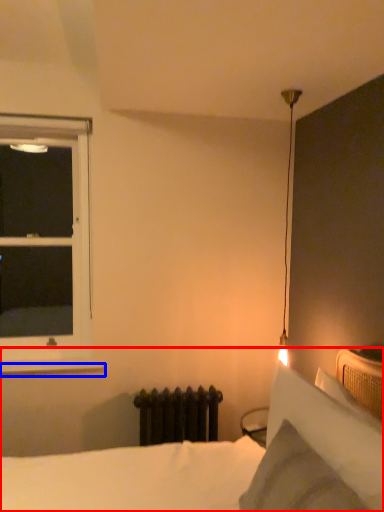
Question: Which point is further to the camera, bed (highlighted by a red box) or window sill (highlighted by a blue box)?

Choices:
 (A) bed
 (B) window sill

Answer: (B)